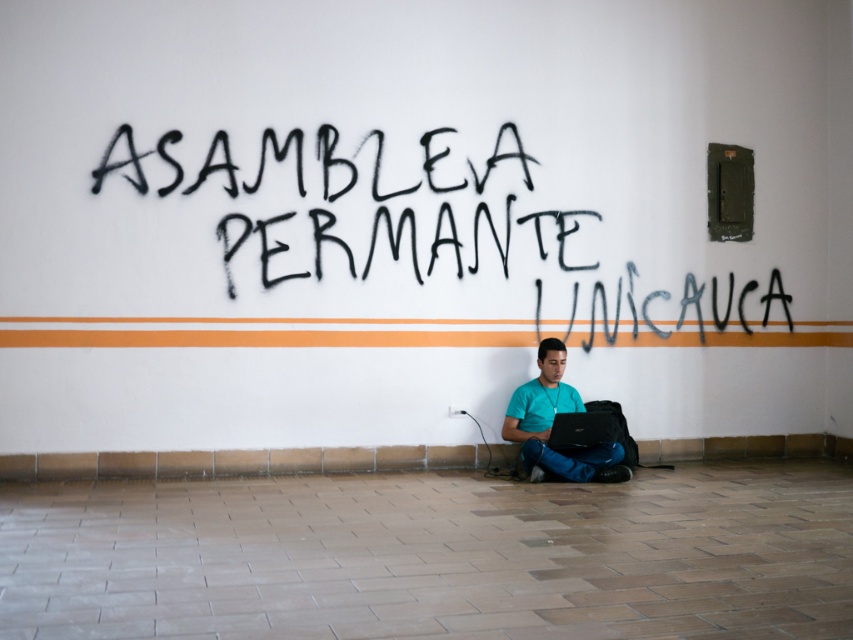
Question: Does black spray paint graffiti at upper center appear under teal matte shirt at lower center?

Choices:
 (A) yes
 (B) no

Answer: (B)

Question: In this image, where is black spray paint graffiti at upper center located relative to teal matte shirt at lower center?

Choices:
 (A) above
 (B) below

Answer: (A)

Question: Which point appears closest to the camera in this image?

Choices:
 (A) (541, 353)
 (B) (564, 440)
 (C) (137, 225)

Answer: (C)

Question: Can you confirm if black spray paint graffiti at upper center is positioned to the right of black matte laptop at lower center?

Choices:
 (A) no
 (B) yes

Answer: (B)

Question: Which object is closer to the camera taking this photo?

Choices:
 (A) teal matte shirt at lower center
 (B) black spray paint graffiti at upper center

Answer: (A)

Question: Among these points, which one is farthest from the camera?

Choices:
 (A) 689,340
 (B) 567,442
 (C) 564,476

Answer: (A)